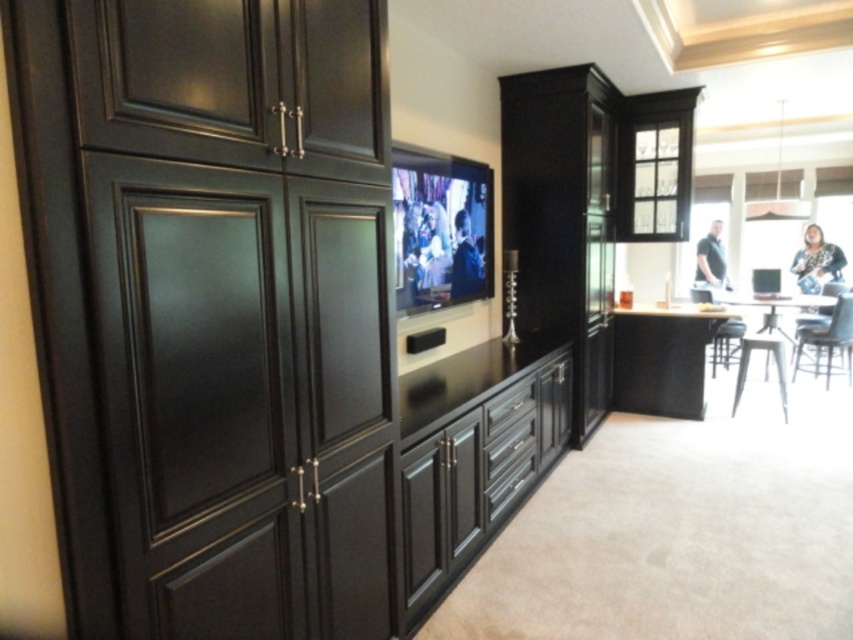
Question: Considering the relative positions of matte black cabinets at center and matte black drawer at center in the image provided, where is matte black cabinets at center located with respect to matte black drawer at center?

Choices:
 (A) right
 (B) left

Answer: (B)

Question: Among these objects, which one is nearest to the camera?

Choices:
 (A) matte black cabinets at center
 (B) flat screen tv at center
 (C) matte black drawer at center

Answer: (A)

Question: Is flat screen tv at center below matte black drawer at center?

Choices:
 (A) yes
 (B) no

Answer: (B)

Question: Which is farther from the matte black cabinets at center?

Choices:
 (A) matte black drawer at center
 (B) flat screen tv at center

Answer: (B)

Question: Is matte black cabinets at center to the right of flat screen tv at center from the viewer's perspective?

Choices:
 (A) yes
 (B) no

Answer: (A)

Question: Among these points, which one is farthest from the camera?

Choices:
 (A) (396, 160)
 (B) (431, 422)
 (C) (515, 390)

Answer: (C)